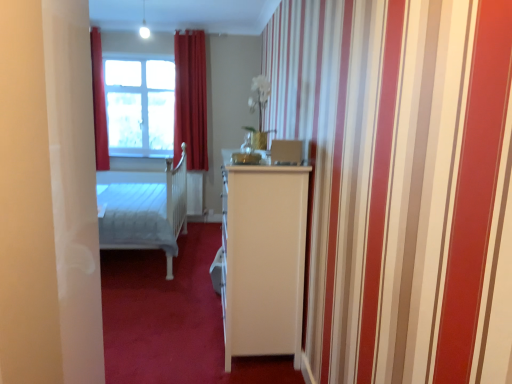
Question: In the image, is velvet red curtain at center on the left side or the right side of white glass window at upper center?

Choices:
 (A) left
 (B) right

Answer: (B)

Question: In terms of height, does velvet red curtain at center look taller or shorter compared to white glass window at upper center?

Choices:
 (A) tall
 (B) short

Answer: (A)

Question: In the image, is velvet red curtain at center positioned in front of or behind white glass window at upper center?

Choices:
 (A) front
 (B) behind

Answer: (A)

Question: Looking at the image, does white glass window at upper center seem bigger or smaller compared to velvet red curtain at center?

Choices:
 (A) small
 (B) big

Answer: (A)

Question: From the image's perspective, is white glass window at upper center positioned above or below velvet red curtain at center?

Choices:
 (A) below
 (B) above

Answer: (B)

Question: Is white glass window at upper center wider or thinner than velvet red curtain at center?

Choices:
 (A) wide
 (B) thin

Answer: (B)

Question: Considering the positions of point (167, 99) and point (193, 43), is point (167, 99) closer or farther from the camera than point (193, 43)?

Choices:
 (A) farther
 (B) closer

Answer: (A)